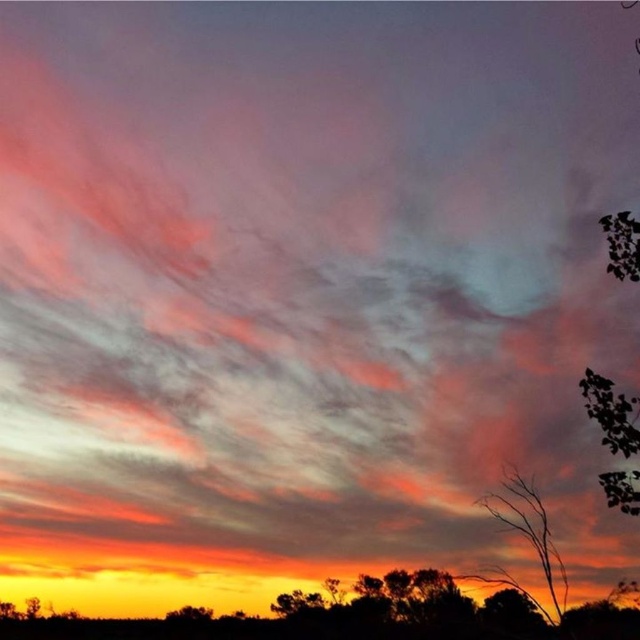
You are an artist trying to sketch the sunset scene. You notice two trees in the foreground. The silhouette bare tree at lower right and the green leafy tree at lower center. Which tree should you draw first if you want to follow the rule of drawing taller objects before shorter ones?

The silhouette bare tree at lower right is much taller than the green leafy tree at lower center, so you should draw the silhouette bare tree at lower right first.

You are standing in the sunset scene and want to take a photo. There are two points in the sky that you want to capture. The first point is at coordinates point (556, 624) and the second is at point (301, 602). Which point will appear closer to you in the photo?

Point (556, 624) is closer to the camera than point (301, 602), so it will appear closer in the photo.

In the scene shown: You are an artist sketching the sunset scene. You need to decide the placement of the green leafy tree at upper right and the green leafy tree at lower center in your drawing. Based on the scene, which tree should you draw higher up in your sketch?

The green leafy tree at upper right should be drawn higher up in the sketch because it is located above the green leafy tree at lower center in the scene.